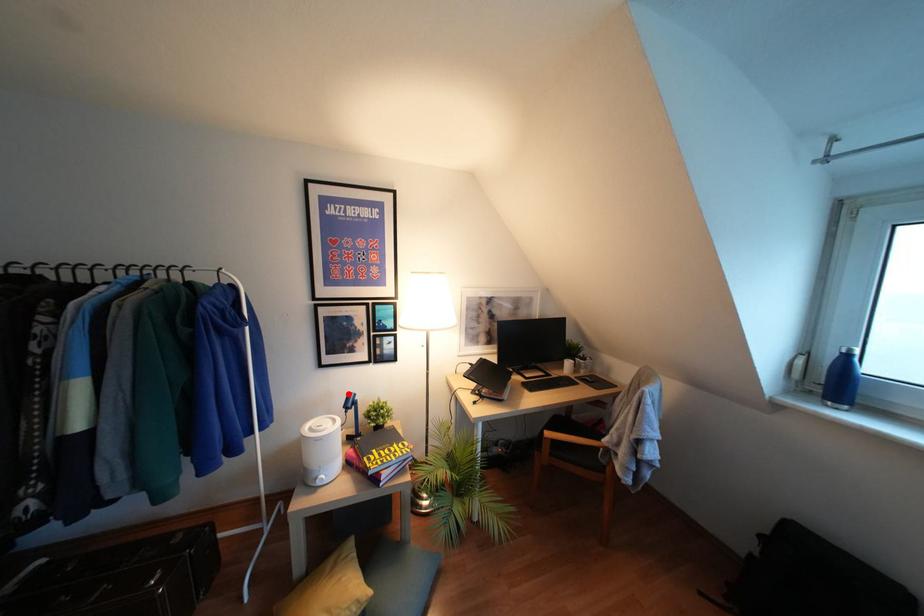
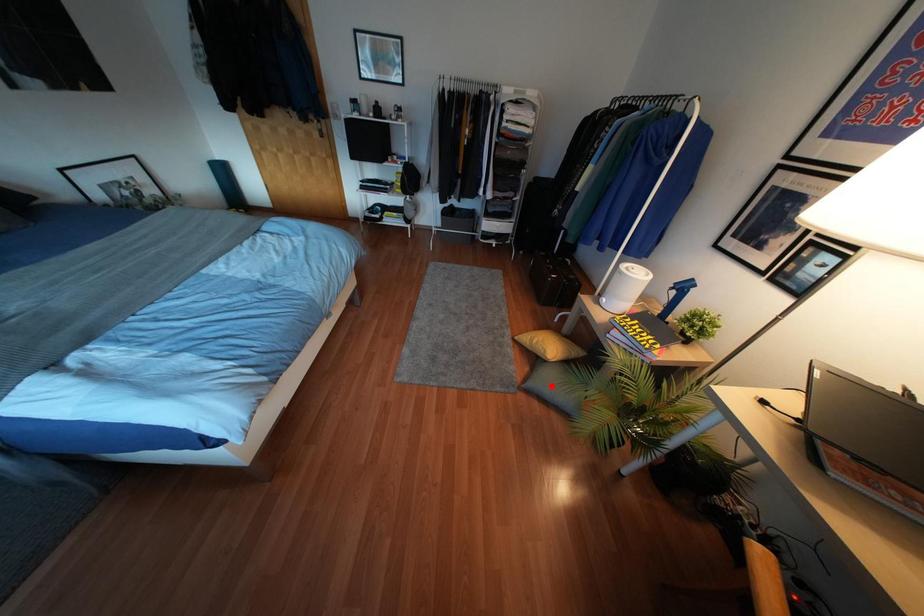
I am providing you with two images of the same scene from different viewpoints. A red point is marked on the first image and another point is marked on the second image. Do the highlighted points in image1 and image2 indicate the same real-world spot?

No